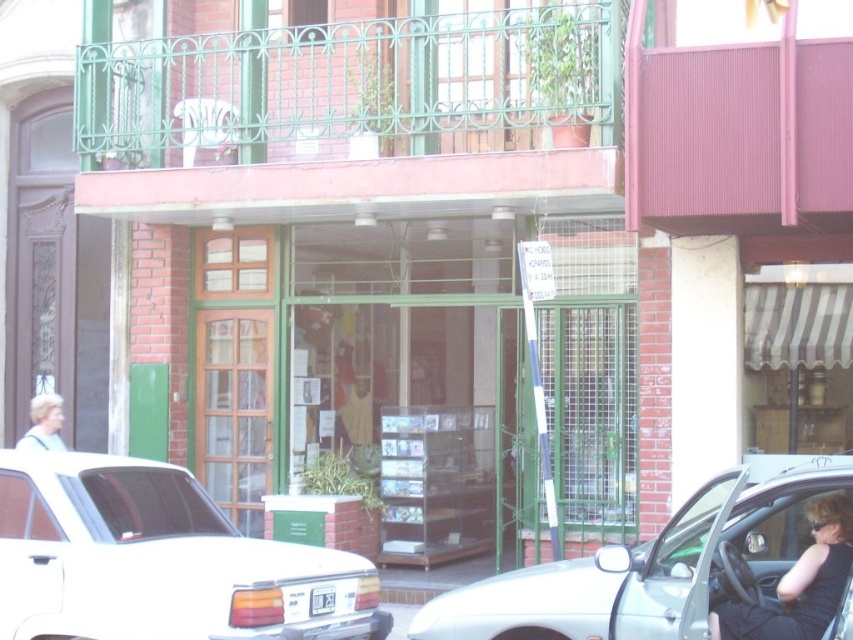
Question: Does silver metallic car at center come in front of black fabric woman at lower right?

Choices:
 (A) yes
 (B) no

Answer: (A)

Question: Is silver metallic car at center below blonde hair at left?

Choices:
 (A) yes
 (B) no

Answer: (A)

Question: Which of these objects is positioned farthest from the blonde hair at left?

Choices:
 (A) silver metallic car at center
 (B) white glossy sedan at center
 (C) black fabric woman at lower right

Answer: (C)

Question: Based on their relative distances, which object is nearer to the black fabric woman at lower right?

Choices:
 (A) blonde hair at left
 (B) silver metallic car at center
 (C) white glossy sedan at center

Answer: (B)

Question: Does black fabric woman at lower right have a larger size compared to blonde hair at left?

Choices:
 (A) no
 (B) yes

Answer: (B)

Question: Which of the following is the farthest from the observer?

Choices:
 (A) (358, 600)
 (B) (727, 616)

Answer: (A)